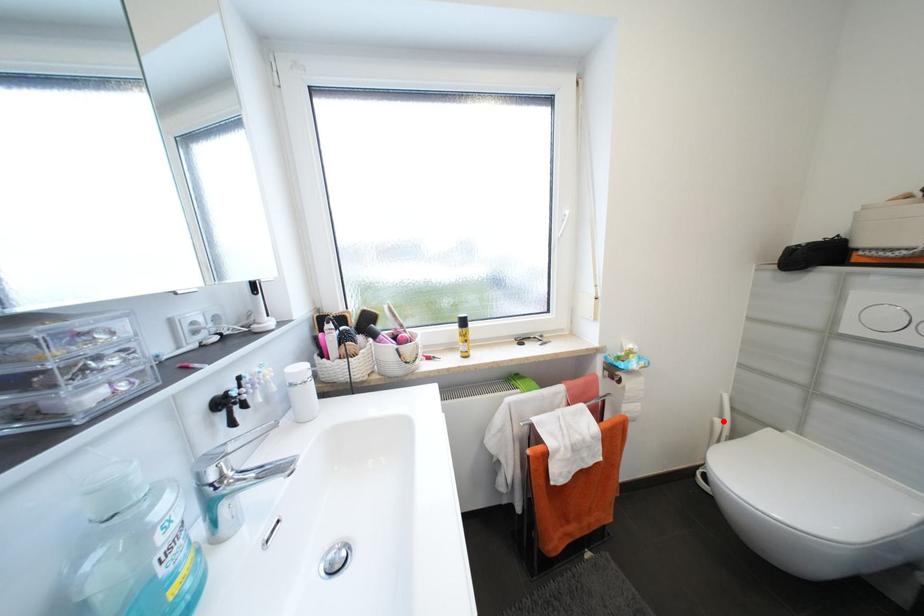
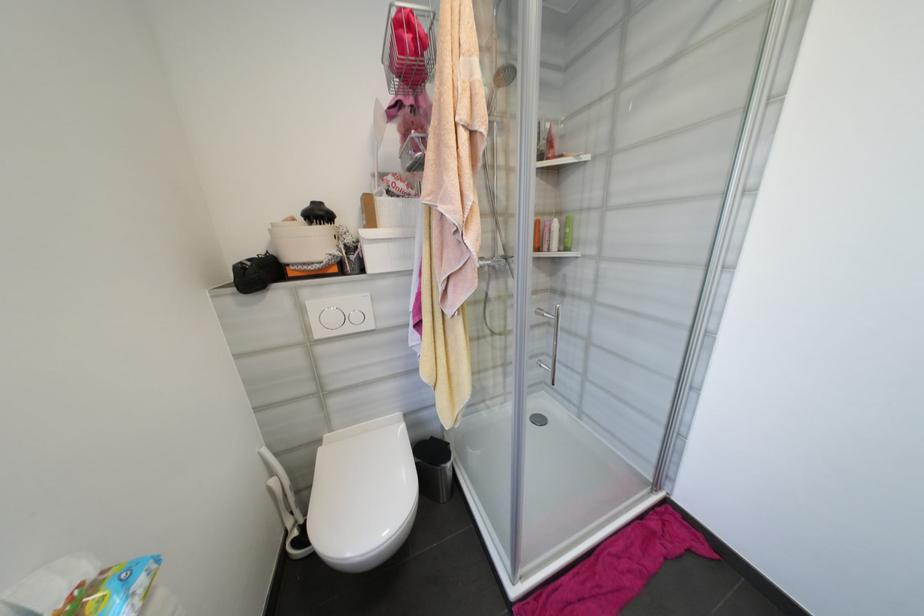
The point at the highlighted location is marked in the first image. Where is the corresponding point in the second image?

(277, 482)